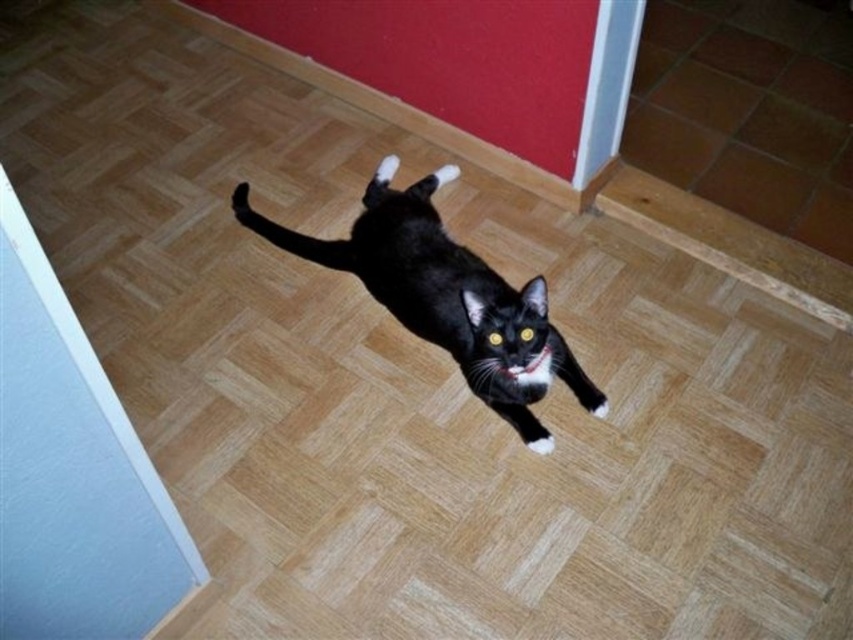
Between black matte paw at center and white fur paw at center, which one is positioned higher?

black matte paw at center

Who is positioned more to the right, black matte paw at center or white fur paw at center?

white fur paw at center

The image size is (853, 640). I want to click on black matte paw at center, so click(241, 198).

Image resolution: width=853 pixels, height=640 pixels. I want to click on black matte paw at center, so click(x=241, y=198).

Which is below, black glossy cat at center or white fur paw at center?

Positioned lower is white fur paw at center.

Who is shorter, black glossy cat at center or white fur paw at center?

white fur paw at center

What are the coordinates of `black glossy cat at center` in the screenshot? It's located at (448, 296).

Between black glossy cat at center and black matte paw at center, which one is positioned higher?

black matte paw at center is higher up.

Can you confirm if black glossy cat at center is shorter than black matte paw at center?

No.

What do you see at coordinates (448, 296) in the screenshot?
I see `black glossy cat at center` at bounding box center [448, 296].

Where is `black glossy cat at center`? black glossy cat at center is located at coordinates (448, 296).